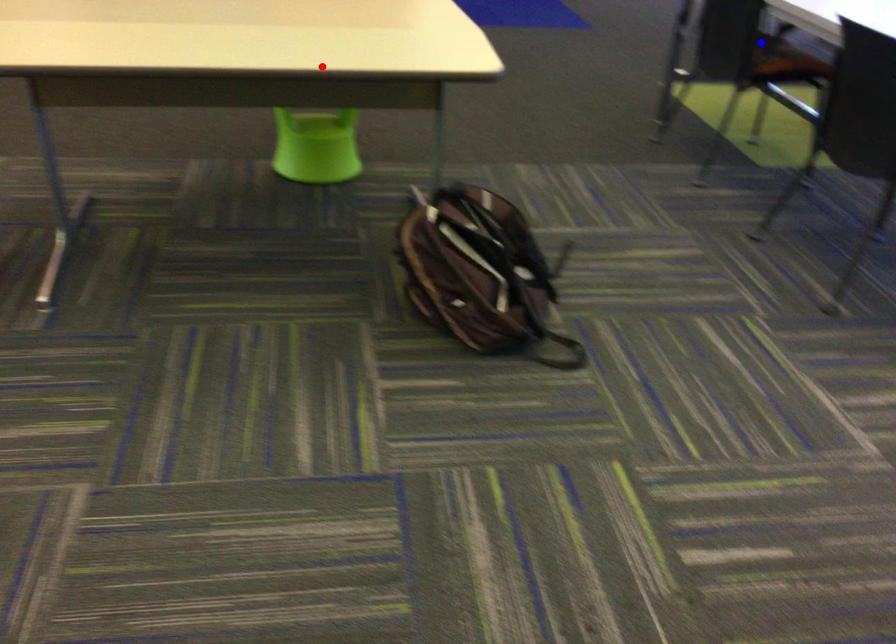
Question: In the image, two points are highlighted. Which point is nearer to the camera? Reply with the corresponding letter.

Choices:
 (A) blue point
 (B) red point

Answer: (B)